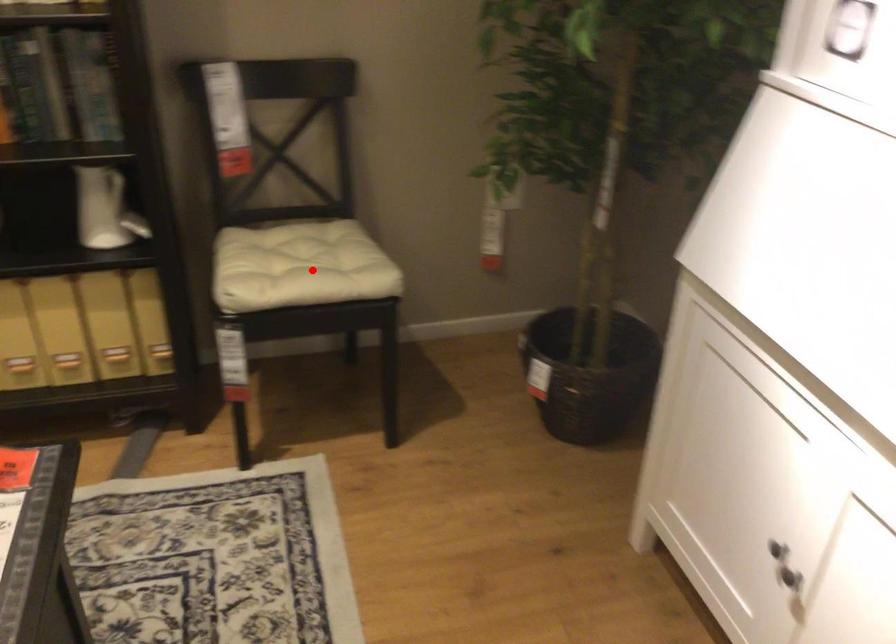
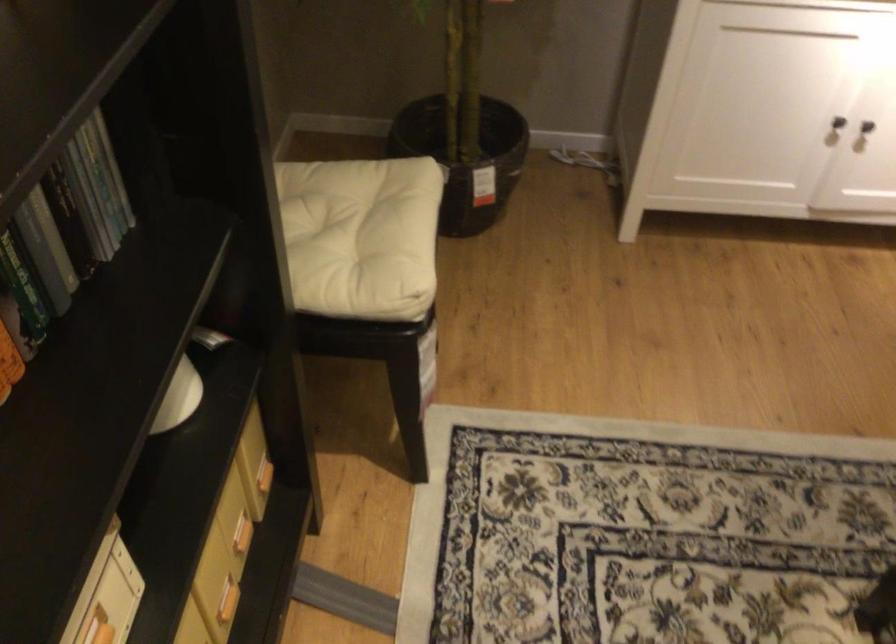
Locate, in the second image, the point that corresponds to the highlighted location in the first image.

(355, 234)